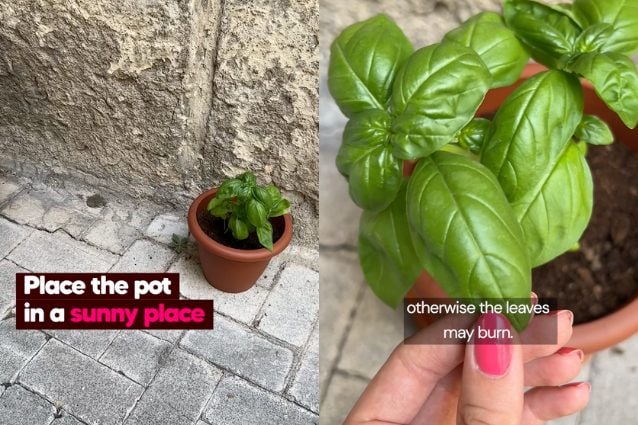
Where is `pot planter`? This screenshot has height=425, width=638. pot planter is located at coordinates (621, 325), (240, 258).